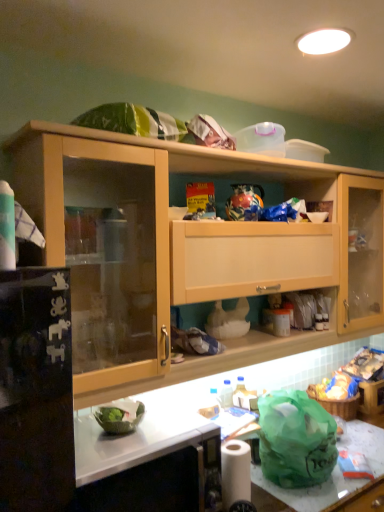
Question: Should I look upward or downward to see white glossy countertop at lower center, positioned as the second counter top in right-to-left order?

Choices:
 (A) down
 (B) up

Answer: (A)

Question: Does white matte toilet paper at lower center have a lesser height compared to white marble countertop at lower center?

Choices:
 (A) no
 (B) yes

Answer: (B)

Question: Is white matte toilet paper at lower center behind white marble countertop at lower center?

Choices:
 (A) yes
 (B) no

Answer: (A)

Question: Is white matte toilet paper at lower center aimed at white marble countertop at lower center?

Choices:
 (A) no
 (B) yes

Answer: (A)

Question: Is white matte toilet paper at lower center to the left of white marble countertop at lower center from the viewer's perspective?

Choices:
 (A) no
 (B) yes

Answer: (B)

Question: From the image's perspective, is white matte toilet paper at lower center below white marble countertop at lower center?

Choices:
 (A) no
 (B) yes

Answer: (A)

Question: Is white matte toilet paper at lower center beside white marble countertop at lower center?

Choices:
 (A) no
 (B) yes

Answer: (A)

Question: Can you confirm if green plastic bag at lower right, positioned as the first counter top in right-to-left order, is positioned to the left of white glossy countertop at lower center, arranged as the second counter top when ordered from the bottom?

Choices:
 (A) no
 (B) yes

Answer: (A)

Question: Is green plastic bag at lower right, the second counter top positioned from the top, not within white glossy countertop at lower center, positioned as the second counter top in right-to-left order?

Choices:
 (A) yes
 (B) no

Answer: (A)

Question: Is white glossy countertop at lower center, which ranks as the first counter top in left-to-right order, completely or partially inside green plastic bag at lower right, positioned as the first counter top in right-to-left order?

Choices:
 (A) yes
 (B) no

Answer: (B)

Question: Is green plastic bag at lower right, the 2th counter top in the left-to-right sequence, wider than white glossy countertop at lower center, positioned as the second counter top in right-to-left order?

Choices:
 (A) yes
 (B) no

Answer: (B)

Question: Is green plastic bag at lower right, the second counter top positioned from the top, bigger than white glossy countertop at lower center, positioned as the second counter top in right-to-left order?

Choices:
 (A) no
 (B) yes

Answer: (A)

Question: Could you tell me if green plastic bag at lower right, which appears as the first counter top when ordered from the bottom, is facing white glossy countertop at lower center, placed as the first counter top when sorted from top to bottom?

Choices:
 (A) yes
 (B) no

Answer: (B)

Question: Considering the relative sizes of white glossy countertop at lower center, positioned as the second counter top in right-to-left order, and white matte toilet paper at lower center in the image provided, is white glossy countertop at lower center, positioned as the second counter top in right-to-left order, bigger than white matte toilet paper at lower center?

Choices:
 (A) no
 (B) yes

Answer: (B)